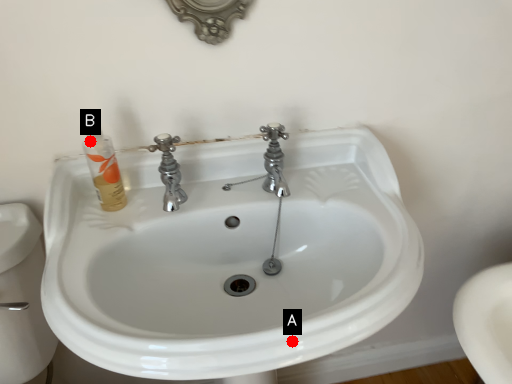
Question: Two points are circled on the image, labeled by A and B beside each circle. Among these points, which one is nearest to the camera?

Choices:
 (A) A is closer
 (B) B is closer

Answer: (A)